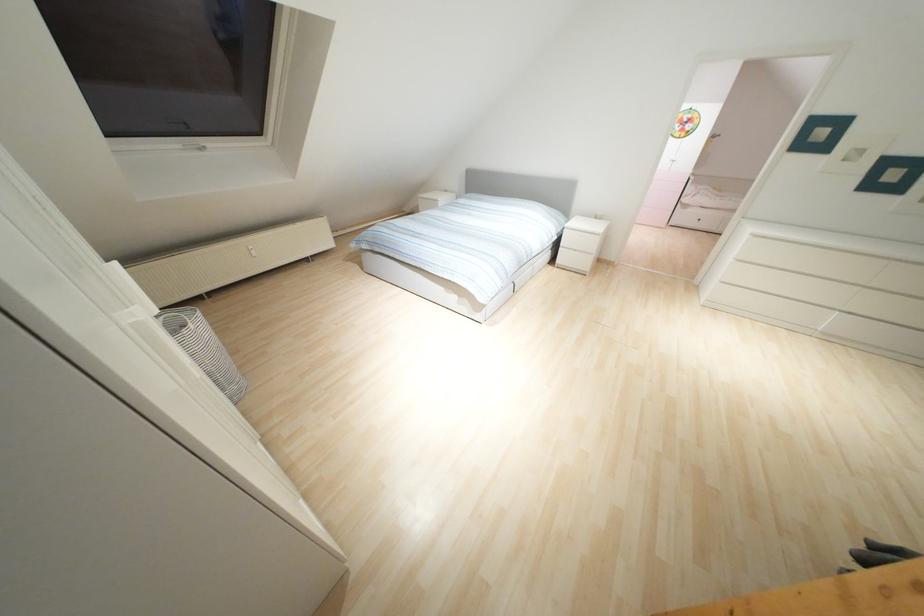
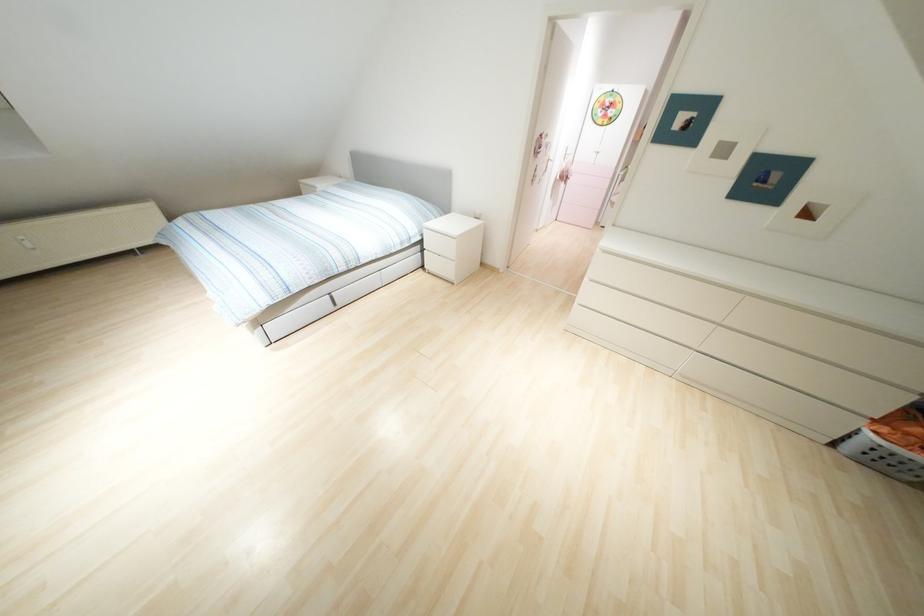
Question: The images are taken continuously from a first-person perspective. In which direction are you moving?

Choices:
 (A) Left
 (B) Right
 (C) Forward
 (D) Backward

Answer: (B)